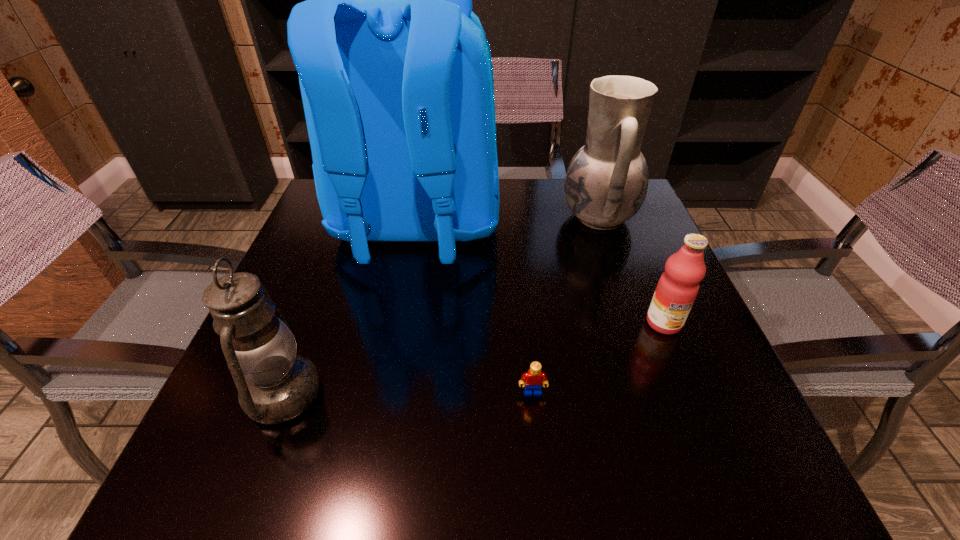
I want to click on fruit juice that is at the right edge, so click(677, 288).

The image size is (960, 540). What are the coordinates of `object positioned at the far left corner` in the screenshot? It's located at (395, 71).

Locate an element on the screen. Image resolution: width=960 pixels, height=540 pixels. object at the near left corner is located at coordinates (275, 385).

Image resolution: width=960 pixels, height=540 pixels. What are the coordinates of `object that is at the far right corner` in the screenshot? It's located at (606, 183).

Where is `vacant region at the far edge of the desktop`? vacant region at the far edge of the desktop is located at coordinates (542, 207).

In order to click on vacant area at the near edge in this screenshot , I will do `click(552, 457)`.

I want to click on free space at the left edge, so click(x=296, y=247).

Image resolution: width=960 pixels, height=540 pixels. I want to click on vacant space at the right edge, so click(x=634, y=287).

In the image, there is a desktop. At what (x,y) coordinates should I click in order to perform the action: click on vacant space at the near left corner. Please return your answer as a coordinate pair (x, y). Looking at the image, I should click on (241, 494).

The width and height of the screenshot is (960, 540). What are the coordinates of `unoccupied position between the second shortest object and the pitcher` in the screenshot? It's located at (631, 270).